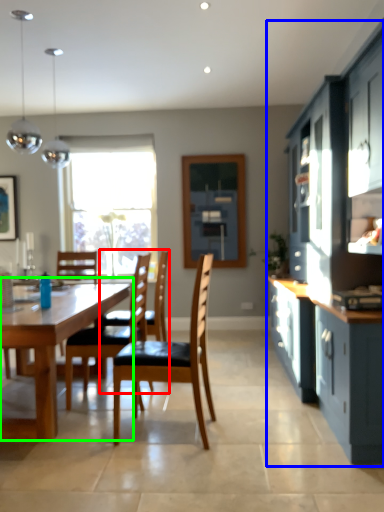
Question: Which is farther away from chair (highlighted by a red box)? cabinetry (highlighted by a blue box) or kitchen & dining room table (highlighted by a green box)?

Choices:
 (A) cabinetry
 (B) kitchen & dining room table

Answer: (A)